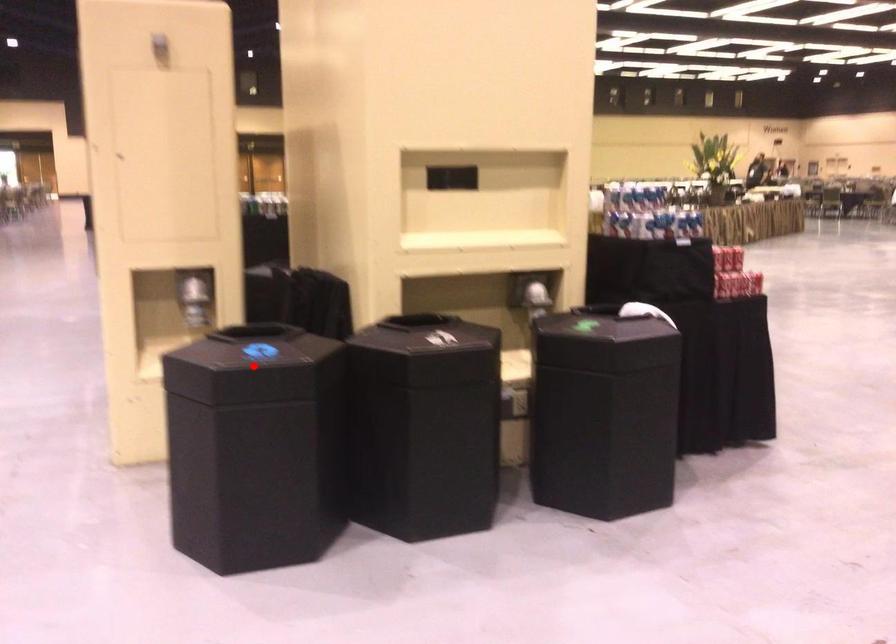
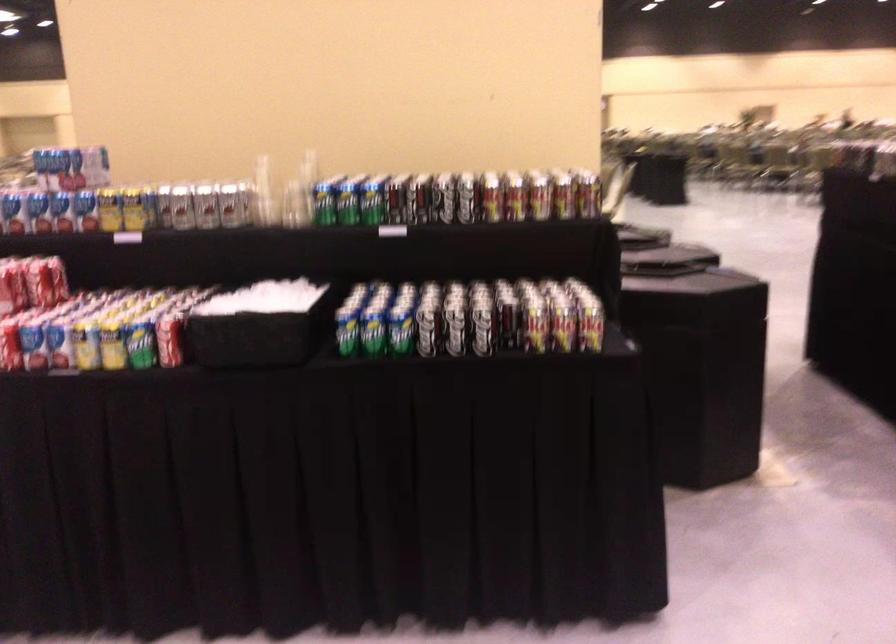
Question: I am providing you with two images of the same scene from different viewpoints. A red point is marked on the first image. Can you still see the location of the red point in image 2?

Choices:
 (A) Yes
 (B) No

Answer: (B)